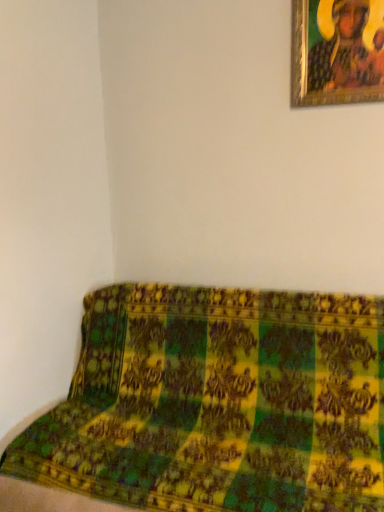
The height and width of the screenshot is (512, 384). Describe the element at coordinates (219, 403) in the screenshot. I see `green fabric couch at lower right` at that location.

Measure the distance between green fabric couch at lower right and camera.

The depth of green fabric couch at lower right is 1.43 meters.

The image size is (384, 512). Find the location of `green fabric couch at lower right`. green fabric couch at lower right is located at coordinates (219, 403).

Locate an element on the screen. The image size is (384, 512). gold-framed painting at upper right is located at coordinates (337, 52).

Describe the element at coordinates (337, 52) in the screenshot. I see `gold-framed painting at upper right` at that location.

I want to click on green fabric couch at lower right, so click(219, 403).

Considering the relative positions of gold-framed painting at upper right and green fabric couch at lower right in the image provided, is gold-framed painting at upper right to the left of green fabric couch at lower right from the viewer's perspective?

No, gold-framed painting at upper right is not to the left of green fabric couch at lower right.

Is gold-framed painting at upper right behind green fabric couch at lower right?

That is True.

Does point (316, 33) appear closer or farther from the camera than point (189, 443)?

Point (316, 33).

From the image's perspective, between gold-framed painting at upper right and green fabric couch at lower right, who is located below?

From the image's view, green fabric couch at lower right is below.

Based on the photo, from a real-world perspective, is gold-framed painting at upper right located beneath green fabric couch at lower right?

No, from a real-world perspective, gold-framed painting at upper right is not below green fabric couch at lower right.

Which of these two, gold-framed painting at upper right or green fabric couch at lower right, is wider?

Wider between the two is green fabric couch at lower right.

Is gold-framed painting at upper right taller than green fabric couch at lower right?

Incorrect, the height of gold-framed painting at upper right is not larger of that of green fabric couch at lower right.

Who is bigger, gold-framed painting at upper right or green fabric couch at lower right?

With larger size is green fabric couch at lower right.

Would you say gold-framed painting at upper right is inside or outside green fabric couch at lower right?

gold-framed painting at upper right exists outside the volume of green fabric couch at lower right.

Is the surface of gold-framed painting at upper right in direct contact with green fabric couch at lower right?

No.

Is gold-framed painting at upper right oriented away from green fabric couch at lower right?

No, gold-framed painting at upper right is not facing away from green fabric couch at lower right.

What's the angular difference between gold-framed painting at upper right and green fabric couch at lower right's facing directions?

There is a 0.177-degree angle between the facing directions of gold-framed painting at upper right and green fabric couch at lower right.

Measure the distance between gold-framed painting at upper right and green fabric couch at lower right.

1.30 meters.

Find the location of a particular element. furniture below the gold-framed painting at upper right (from the image's perspective) is located at coordinates (219, 403).

Which is more to the left, green fabric couch at lower right or gold-framed painting at upper right?

Positioned to the left is green fabric couch at lower right.

Is green fabric couch at lower right in front of gold-framed painting at upper right?

Yes, the depth of green fabric couch at lower right is less than that of gold-framed painting at upper right.

Is point (146, 458) farther from viewer compared to point (351, 37)?

No, it is in front of (351, 37).

From the image's perspective, is green fabric couch at lower right positioned above or below gold-framed painting at upper right?

Based on their image positions, green fabric couch at lower right is located beneath gold-framed painting at upper right.

From a real-world perspective, who is located higher, green fabric couch at lower right or gold-framed painting at upper right?

From a 3D spatial view, gold-framed painting at upper right is above.

Considering the relative sizes of green fabric couch at lower right and gold-framed painting at upper right in the image provided, is green fabric couch at lower right wider than gold-framed painting at upper right?

Indeed, green fabric couch at lower right has a greater width compared to gold-framed painting at upper right.

From their relative heights in the image, would you say green fabric couch at lower right is taller or shorter than gold-framed painting at upper right?

green fabric couch at lower right is taller than gold-framed painting at upper right.

Between green fabric couch at lower right and gold-framed painting at upper right, which one has larger size?

With larger size is green fabric couch at lower right.

Is green fabric couch at lower right not within gold-framed painting at upper right?

That's correct, green fabric couch at lower right is outside of gold-framed painting at upper right.

Is green fabric couch at lower right far from gold-framed painting at upper right?

Yes, green fabric couch at lower right and gold-framed painting at upper right are located far from each other.

Is green fabric couch at lower right looking in the opposite direction of gold-framed painting at upper right?

No, green fabric couch at lower right's orientation is not away from gold-framed painting at upper right.

How different are the orientations of green fabric couch at lower right and gold-framed painting at upper right in degrees?

The angular difference between green fabric couch at lower right and gold-framed painting at upper right is 0.177 degrees.

I want to click on furniture in front of the gold-framed painting at upper right, so click(x=219, y=403).

Where is `furniture below the gold-framed painting at upper right (from the image's perspective)`? The image size is (384, 512). furniture below the gold-framed painting at upper right (from the image's perspective) is located at coordinates (219, 403).

You are a GUI agent. You are given a task and a screenshot of the screen. Output one action in this format:
    pyautogui.click(x=<x>, y=<y>)
    Task: Click on the picture frame above the green fabric couch at lower right (from the image's perspective)
    
    Given the screenshot: What is the action you would take?
    pyautogui.click(x=337, y=52)